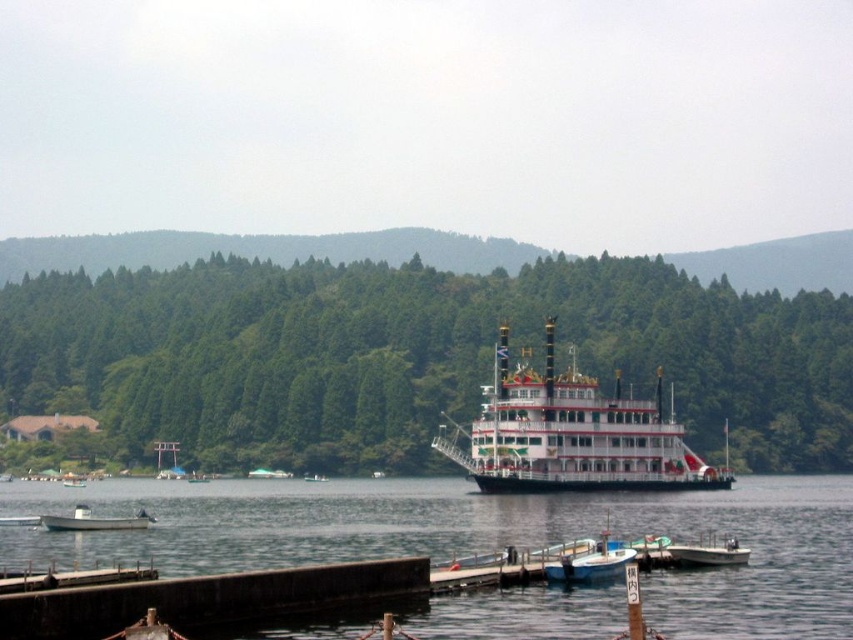
Locate an element on the screen. The width and height of the screenshot is (853, 640). green matte boat at center is located at coordinates (268, 474).

Which is behind, point (282, 474) or point (318, 477)?

Positioned behind is point (282, 474).

Is point (291, 474) positioned behind point (312, 476)?

That is False.

Where is `green matte boat at center`? This screenshot has height=640, width=853. green matte boat at center is located at coordinates (268, 474).

Can you confirm if white wooden paddle steamer at center is taller than white matte boat at lower left?

Indeed, white wooden paddle steamer at center has a greater height compared to white matte boat at lower left.

Looking at this image, who is more forward, [514,468] or [120,529]?

Point [120,529] is in front.

The height and width of the screenshot is (640, 853). In order to click on white wooden paddle steamer at center in this screenshot , I will do `click(572, 433)`.

Does clear water at dock center appear under white glossy boat at center?

No, clear water at dock center is not below white glossy boat at center.

Between clear water at dock center and white glossy boat at center, which one has more height?

clear water at dock center is taller.

Which is in front, point (132, 506) or point (314, 481)?

Point (132, 506) is in front.

The width and height of the screenshot is (853, 640). In order to click on clear water at dock center in this screenshot , I will do `click(480, 538)`.